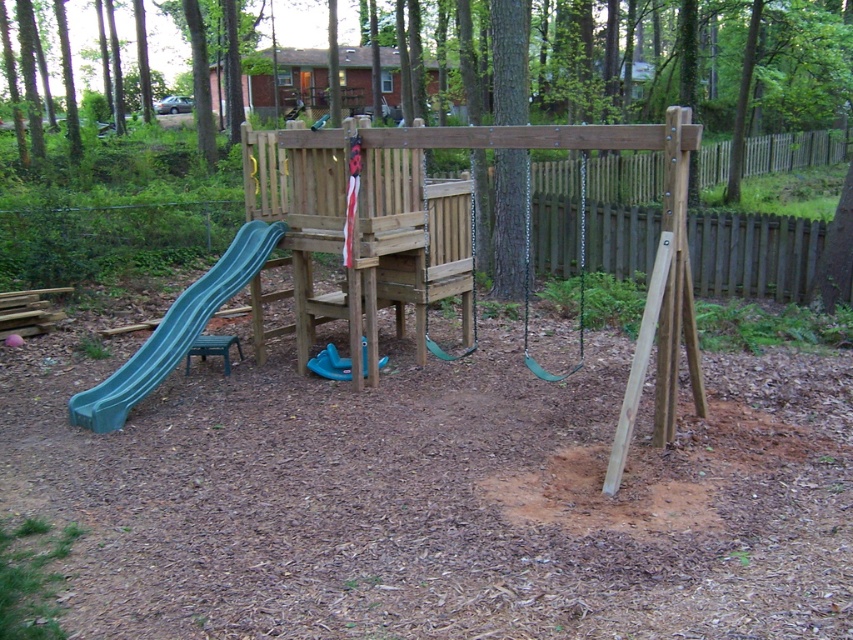
You are a parent checking if the green rubber swing at center and blue rubber slide at center are suitable for a 3 year old. According to safety guidelines, swings must be at least 36 inches wide and slides must be no wider than 24 inches. Can you confirm if both meet the requirements?

The green rubber swing at center might be wider than blue rubber slide at center. Since the swing needs to be at least 36 inches wide and the slide must be no wider than 24 inches, the swing may meet the width requirement if it is wider than 36 inches, but we need to confirm the exact width. The slide might not meet the requirement if it exceeds 24 inches. Please check the actual measurements.

You are standing at the origin point of the backyard play area. Where is the green rubber swing at center located in terms of coordinates?

The green rubber swing at center is located at coordinates point (x=578, y=276).